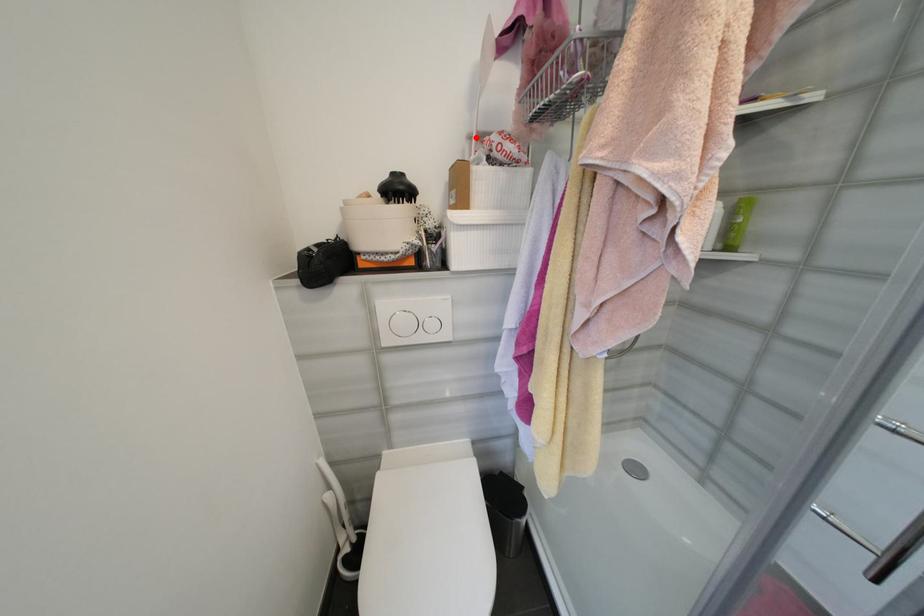
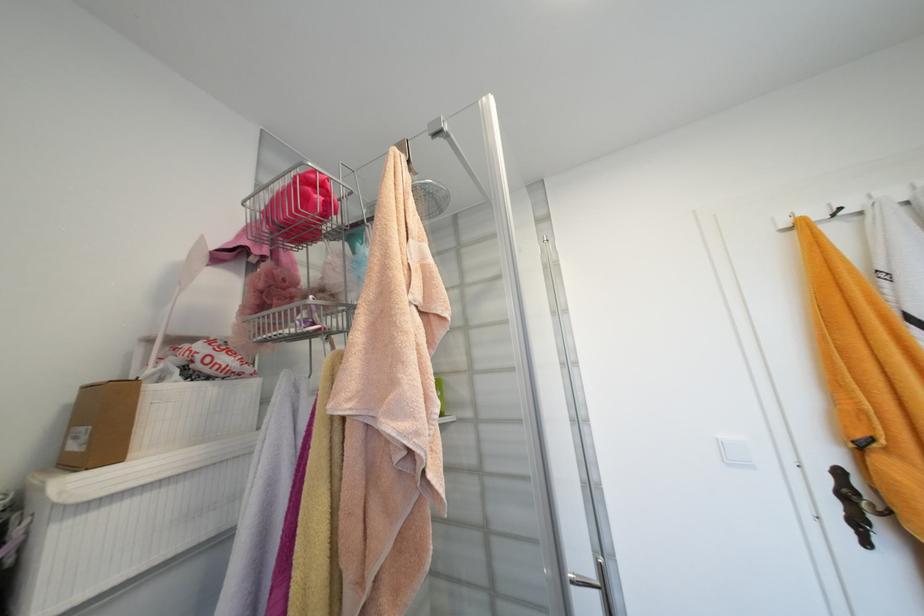
Locate, in the second image, the point that corresponds to the highlighted location in the first image.

(154, 342)